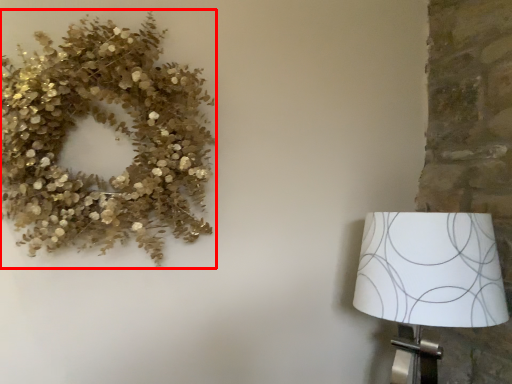
Question: Where is floral arrangement (annotated by the red box) located in relation to lamp in the image?

Choices:
 (A) left
 (B) right

Answer: (A)